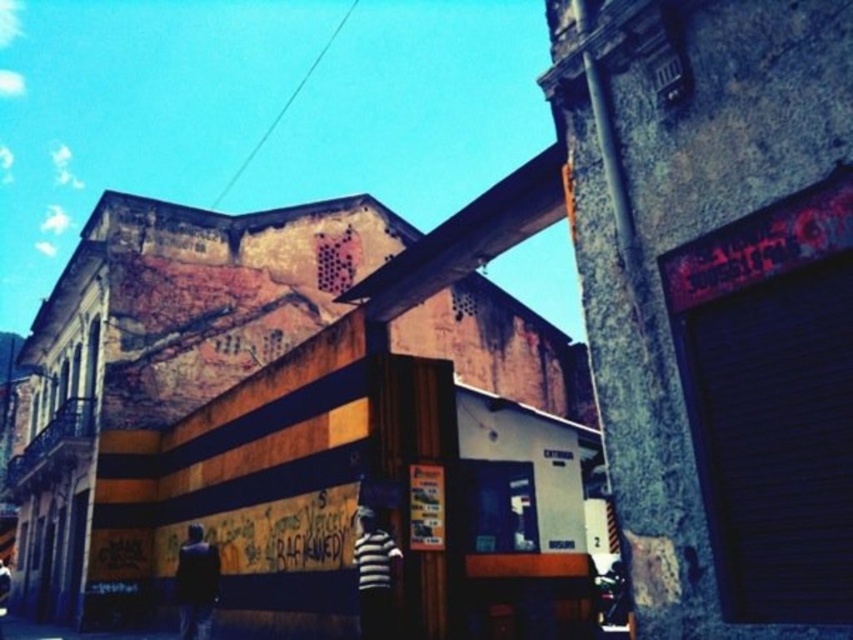
Between point (376, 620) and point (213, 573), which one is positioned in front?

Point (376, 620) is in front.

Who is higher up, striped shirt at center or dark fabric jacket at lower left?

striped shirt at center

Find the location of `striped shirt at center`. striped shirt at center is located at coordinates (373, 576).

Image resolution: width=853 pixels, height=640 pixels. Identify the location of striped shirt at center. (373, 576).